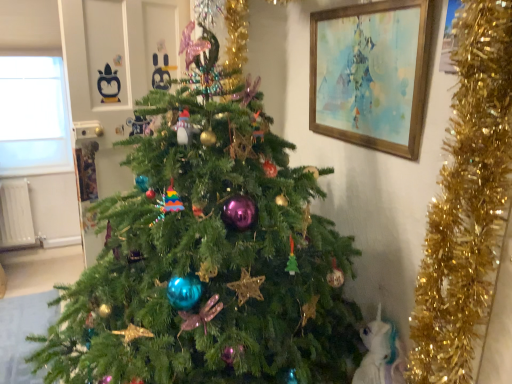
Question: From the image's perspective, does transparent glass window at upper left appear lower than white feathered bird at lower right?

Choices:
 (A) no
 (B) yes

Answer: (A)

Question: From the image's perspective, is transparent glass window at upper left over white feathered bird at lower right?

Choices:
 (A) yes
 (B) no

Answer: (A)

Question: Is transparent glass window at upper left oriented towards white feathered bird at lower right?

Choices:
 (A) no
 (B) yes

Answer: (A)

Question: Can you confirm if transparent glass window at upper left is smaller than white feathered bird at lower right?

Choices:
 (A) yes
 (B) no

Answer: (B)

Question: Does transparent glass window at upper left come in front of white feathered bird at lower right?

Choices:
 (A) yes
 (B) no

Answer: (B)

Question: Considering the positions of wooden framed painting at upper right and green matte christmas tree at center in the image, is wooden framed painting at upper right taller or shorter than green matte christmas tree at center?

Choices:
 (A) tall
 (B) short

Answer: (B)

Question: From the image's perspective, is wooden framed painting at upper right located above or below green matte christmas tree at center?

Choices:
 (A) below
 (B) above

Answer: (B)

Question: Is wooden framed painting at upper right to the left or to the right of green matte christmas tree at center in the image?

Choices:
 (A) right
 (B) left

Answer: (A)

Question: Is point pyautogui.click(x=361, y=94) closer or farther from the camera than point pyautogui.click(x=83, y=349)?

Choices:
 (A) farther
 (B) closer

Answer: (A)

Question: Considering the positions of white feathered bird at lower right and wooden framed painting at upper right in the image, is white feathered bird at lower right bigger or smaller than wooden framed painting at upper right?

Choices:
 (A) small
 (B) big

Answer: (A)

Question: Looking at their shapes, would you say white feathered bird at lower right is wider or thinner than wooden framed painting at upper right?

Choices:
 (A) thin
 (B) wide

Answer: (B)

Question: From a real-world perspective, relative to wooden framed painting at upper right, is white feathered bird at lower right vertically above or below?

Choices:
 (A) above
 (B) below

Answer: (B)

Question: From their relative heights in the image, would you say white feathered bird at lower right is taller or shorter than wooden framed painting at upper right?

Choices:
 (A) short
 (B) tall

Answer: (A)

Question: Is wooden framed painting at upper right inside the boundaries of white feathered bird at lower right, or outside?

Choices:
 (A) inside
 (B) outside

Answer: (B)

Question: From a real-world perspective, is wooden framed painting at upper right above or below white feathered bird at lower right?

Choices:
 (A) above
 (B) below

Answer: (A)